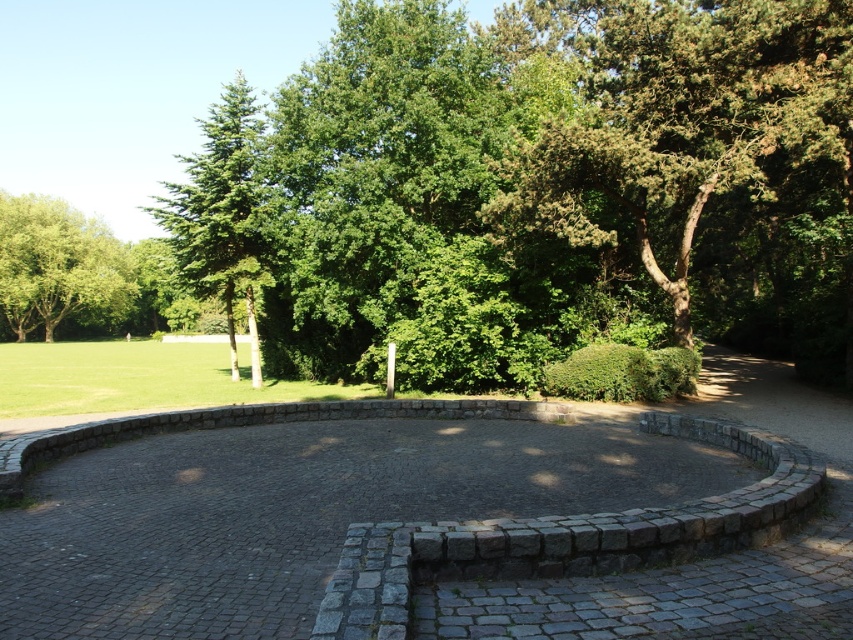
Does green leafy tree at left have a greater width compared to green leafy bush at center?

Yes, green leafy tree at left is wider than green leafy bush at center.

Does green leafy tree at left have a greater height compared to green leafy bush at center?

Correct, green leafy tree at left is much taller as green leafy bush at center.

Who is more forward, (21, 280) or (682, 388)?

Point (682, 388) is in front.

Identify the location of green leafy tree at left. The image size is (853, 640). (56, 264).

Which is below, green textured tree at upper right or green leafy bush at center?

green leafy bush at center is below.

Who is positioned more to the right, green textured tree at upper right or green leafy bush at center?

Positioned to the right is green textured tree at upper right.

The height and width of the screenshot is (640, 853). I want to click on green textured tree at upper right, so click(698, 152).

Does green leafy tree at upper left come behind green leafy bush at center?

That is True.

Does green leafy tree at upper left have a smaller size compared to green leafy bush at center?

Actually, green leafy tree at upper left might be larger than green leafy bush at center.

Identify the location of green leafy tree at upper left. 221,212.